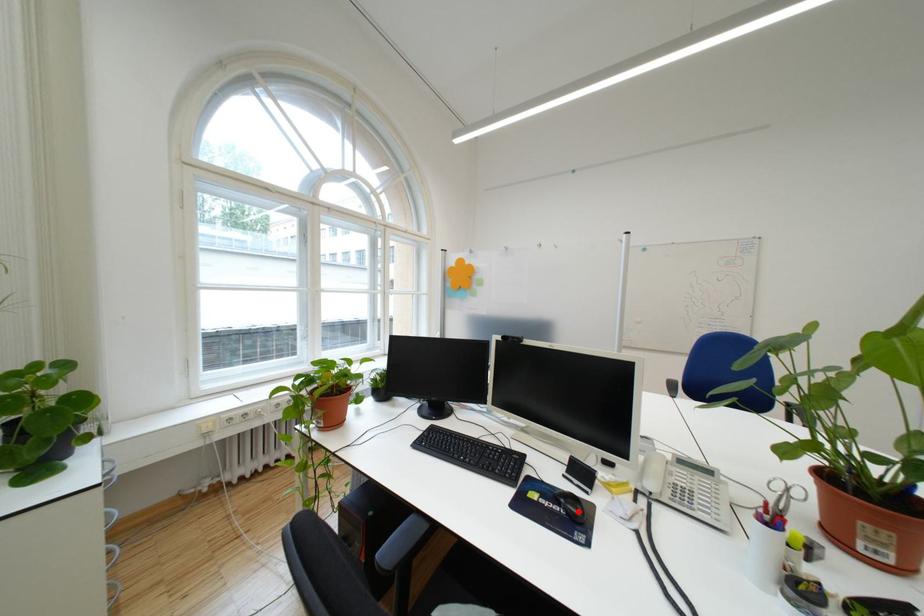
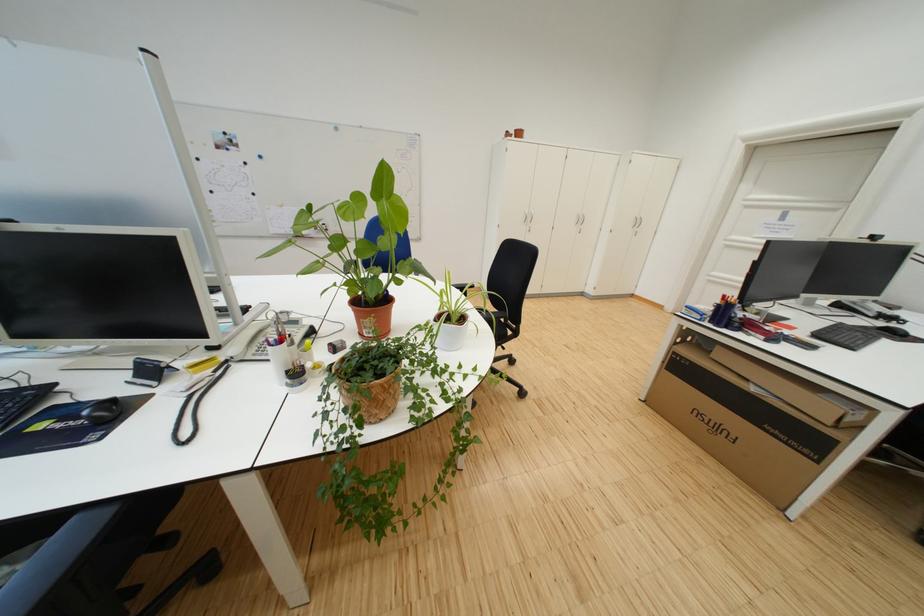
Locate, in the second image, the point that corresponds to the highlighted location in the first image.

(103, 419)